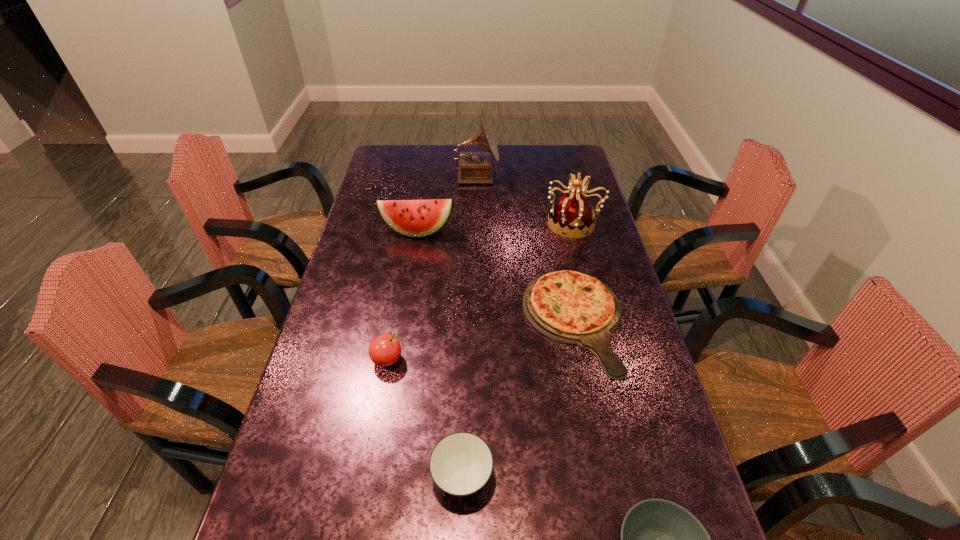
Where is `pizza positioned at the right edge`? The height and width of the screenshot is (540, 960). pizza positioned at the right edge is located at coordinates (570, 307).

Where is `vacant space at the left edge of the desktop`? The height and width of the screenshot is (540, 960). vacant space at the left edge of the desktop is located at coordinates point(322,371).

The image size is (960, 540). I want to click on vacant point at the right edge, so click(613, 449).

In the image, there is a desktop. Where is `vacant space at the far left corner`? vacant space at the far left corner is located at coordinates (403, 147).

The height and width of the screenshot is (540, 960). In the image, there is a desktop. Identify the location of vacant space at the far right corner. (575, 146).

Locate an element on the screen. This screenshot has width=960, height=540. vacant area that lies between the shortest object and the apple is located at coordinates [481, 340].

Where is `vacant area that lies between the farther soup bowl and the pizza`? The width and height of the screenshot is (960, 540). vacant area that lies between the farther soup bowl and the pizza is located at coordinates (518, 399).

This screenshot has width=960, height=540. In order to click on free space between the tallest object and the tiara in this screenshot , I will do `click(525, 200)`.

Find the location of a particular element. free area in between the farther soup bowl and the tiara is located at coordinates (517, 350).

Identify the location of empty space between the phonograph record and the second nearest object. Image resolution: width=960 pixels, height=540 pixels. (469, 327).